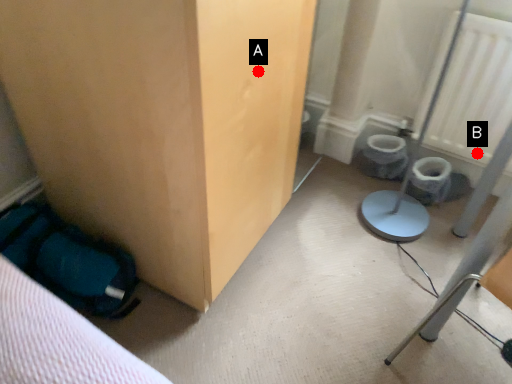
Question: Two points are circled on the image, labeled by A and B beside each circle. Among these points, which one is nearest to the camera?

Choices:
 (A) A is closer
 (B) B is closer

Answer: (A)